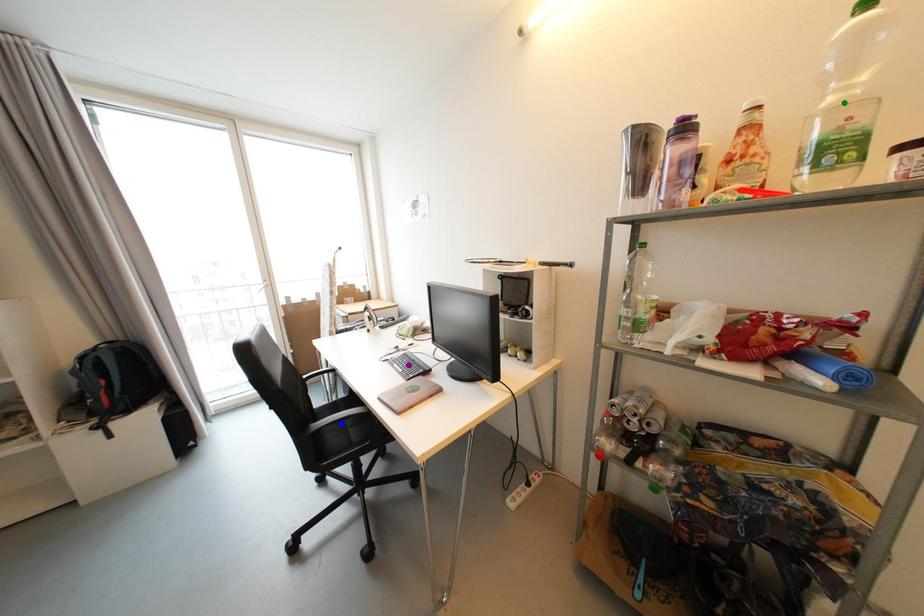
Order these from nearest to farthest:
purple point | blue point | green point

green point → blue point → purple point